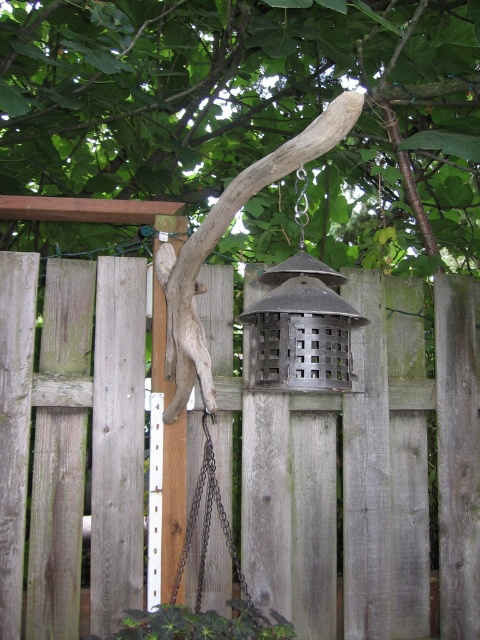
Question: Which point appears farthest from the camera in this image?

Choices:
 (A) (224, 524)
 (B) (268, 340)

Answer: (A)

Question: Does metallic wire mesh bird cage at center appear under black metal chain at center?

Choices:
 (A) no
 (B) yes

Answer: (A)

Question: Is weathered wood fence at center wider than black metal chain at center?

Choices:
 (A) no
 (B) yes

Answer: (B)

Question: Is metallic wire mesh bird cage at center above black metal chain at center?

Choices:
 (A) yes
 (B) no

Answer: (A)

Question: Which point is closer to the camera taking this photo?

Choices:
 (A) (348, 339)
 (B) (201, 544)

Answer: (A)

Question: Which point is closer to the camera taking this photo?

Choices:
 (A) (200, 372)
 (B) (186, 548)
 (C) (300, 314)
 (D) (397, 497)

Answer: (C)